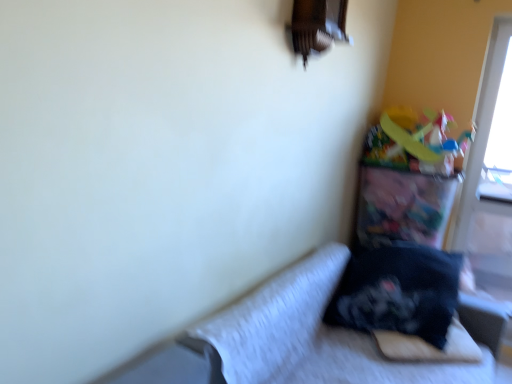
Question: From the image's perspective, is black soft pillow at lower right positioned above or below velvet black pillow at lower right?

Choices:
 (A) above
 (B) below

Answer: (A)

Question: Is black soft pillow at lower right spatially inside velvet black pillow at lower right, or outside of it?

Choices:
 (A) inside
 (B) outside

Answer: (A)

Question: Considering the real-world distances, which object is closest to the black soft pillow at lower right?

Choices:
 (A) transparent plastic screen door at right
 (B) velvet black pillow at lower right

Answer: (B)

Question: Which object is positioned farthest from the transparent plastic screen door at right?

Choices:
 (A) velvet black pillow at lower right
 (B) black soft pillow at lower right

Answer: (A)